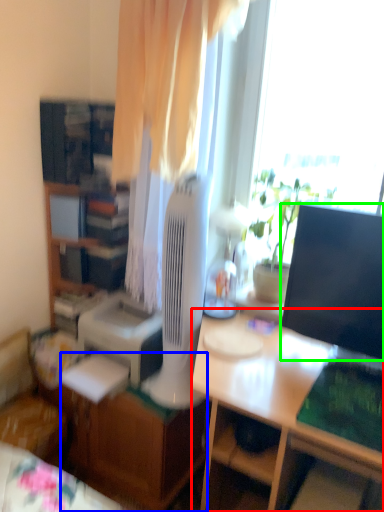
Question: Which is farther away from desk (highlighted by a red box)? desk (highlighted by a blue box) or television (highlighted by a green box)?

Choices:
 (A) desk
 (B) television

Answer: (A)